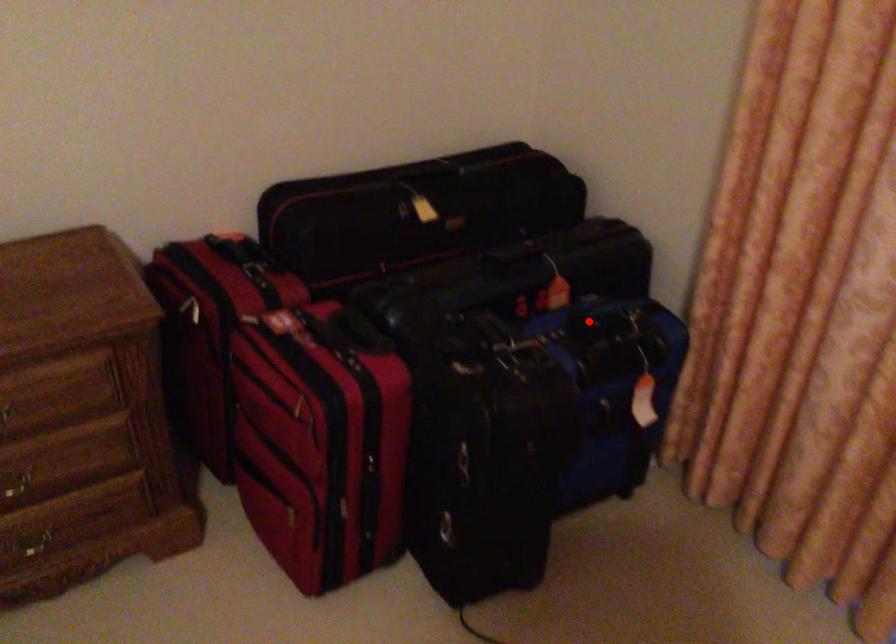
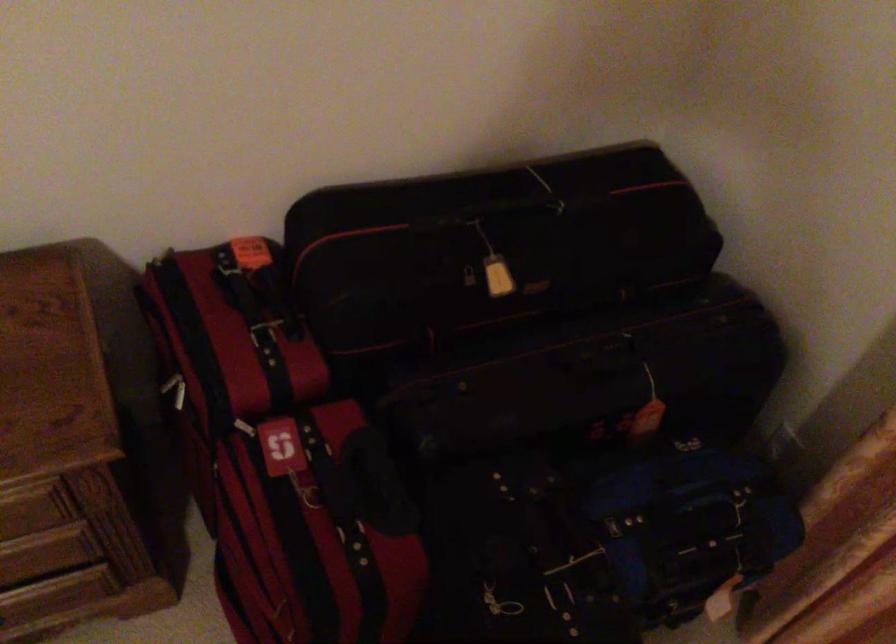
Find the pixel in the second image that matches the highlighted location in the first image.

(676, 507)